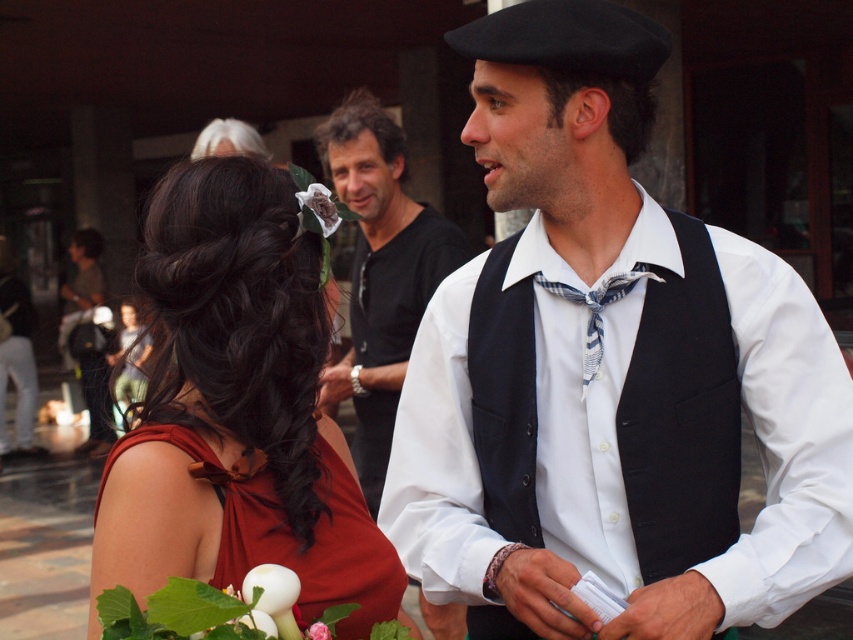
Question: Does black wool vest at center appear on the right side of pink fabric flower at center?

Choices:
 (A) yes
 (B) no

Answer: (A)

Question: From the image, what is the correct spatial relationship of matte red dress at lower left in relation to blue plaid bow tie at center?

Choices:
 (A) below
 (B) above

Answer: (A)

Question: Does black wool vest at center have a smaller size compared to white cotton shirt at center?

Choices:
 (A) no
 (B) yes

Answer: (B)

Question: Which of the following is the closest to the observer?

Choices:
 (A) (511, 205)
 (B) (366, 266)
 (C) (531, 497)
 (D) (323, 630)

Answer: (D)

Question: Which object is farther from the camera taking this photo?

Choices:
 (A) white matte flower at center
 (B) shiny red dress at center
 (C) pink fabric flower at center

Answer: (A)

Question: Which object appears closest to the camera in this image?

Choices:
 (A) pink fabric flower at center
 (B) white matte flower at center

Answer: (A)